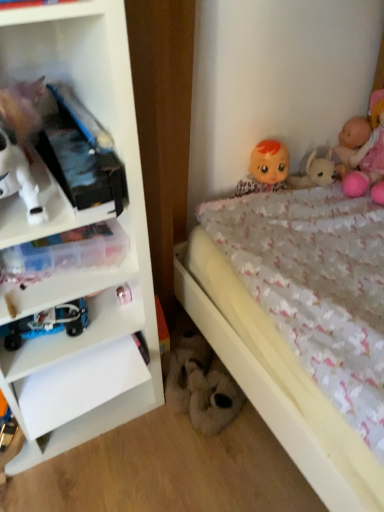
Question: From the image's perspective, is metallic silver toy at lower left, which appears as the second toy when viewed from the left, located above or below smooth plastic doll at upper right, which is the 1th doll in left-to-right order?

Choices:
 (A) above
 (B) below

Answer: (B)

Question: Looking at their shapes, would you say metallic silver toy at lower left, marked as the 2th toy in a front-to-back arrangement, is wider or thinner than smooth plastic doll at upper right, which is the 1th doll in left-to-right order?

Choices:
 (A) wide
 (B) thin

Answer: (B)

Question: Considering the real-world distances, which object is farthest from the smooth pink doll at upper right, which is counted as the second doll, starting from the right?

Choices:
 (A) fluffy white plush at lower center, the 3th toy from the top
 (B) white plastic shelf at left
 (C) pink plush doll at upper right, the third doll viewed from the left
 (D) blue metallic car at lower left, which is the 1th toy from front to back
 (E) smooth plastic doll at upper right, marked as the 3th doll in a right-to-left arrangement

Answer: (D)

Question: Which is farther from the fluffy white plush at lower center, the third toy when ordered from front to back?

Choices:
 (A) blue metallic car at lower left, which ranks as the second toy in top-to-bottom order
 (B) smooth pink doll at upper right, the second doll when ordered from left to right
 (C) pink plush doll at upper right, the 1th doll viewed from the right
 (D) white plastic shelf at left
 (E) smooth plastic doll at upper right, marked as the 3th doll in a right-to-left arrangement

Answer: (B)